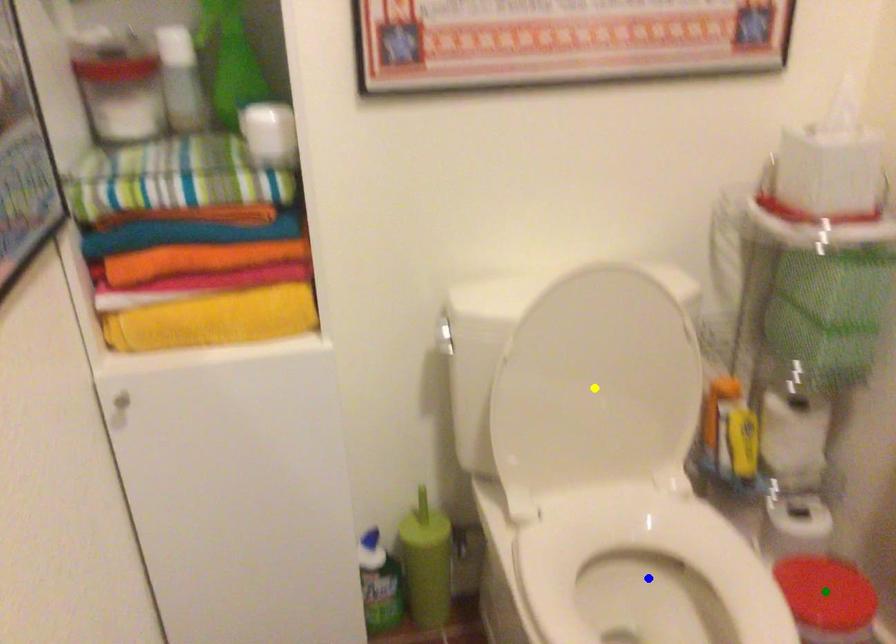
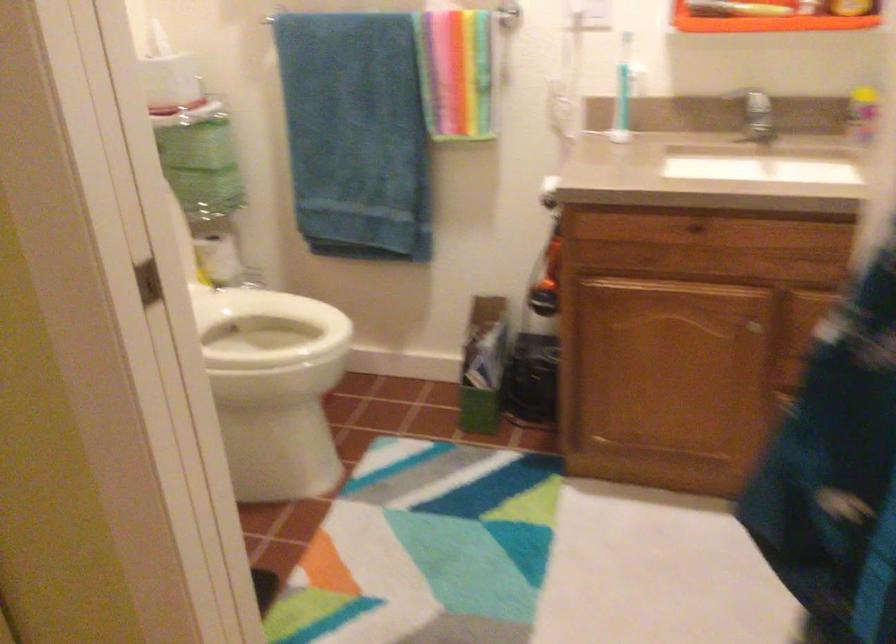
I am providing you with two images of the same scene from different viewpoints. Three points are marked in image1. Which point corresponds to a part or object that is occluded in image2?In image1, three points are marked. Which of them correspond to a part or object that is occluded in image2?Among the three points shown in image1, which one corresponds to a part or object that is no longer visible due to occlusion in image2?

green point, blue point, yellow point